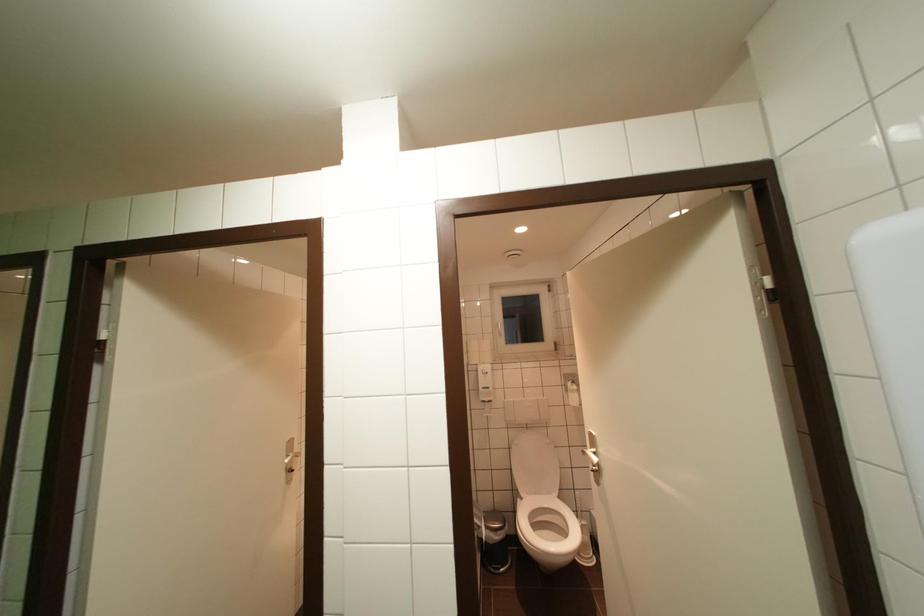
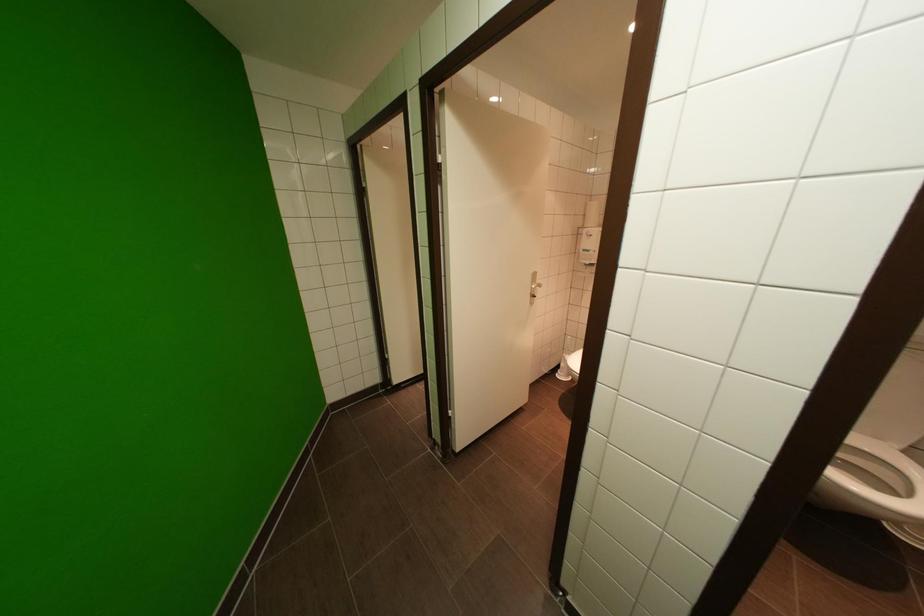
First-person continuous shooting, in which direction is the camera rotating?

The camera's rotation is toward left-down.